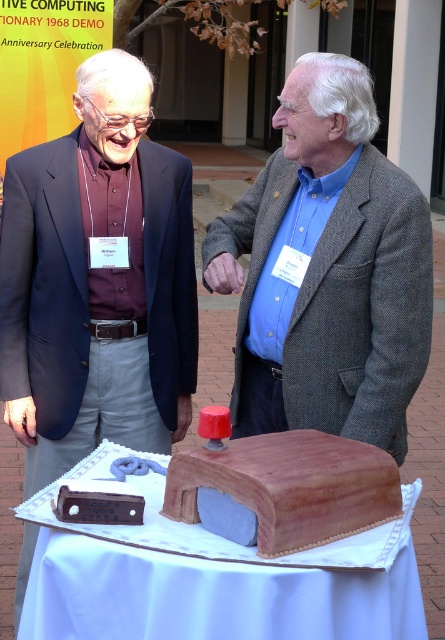
You are a photographer at the event and want to take a picture of the vintage computer cake on the table. There is a point at coordinates point (327, 269) that you need to consider. Is this point located on the vintage computer cake?

The point (327, 269) is on blue woolen jacket at center, so it is not on the vintage computer cake.

You are a photographer at the event and need to position a spotlight exactly at the location of the blue woolen jacket at center. What are the coordinates where you should place the spotlight?

The coordinates for the blue woolen jacket at center are at point (327, 269).

Based on the scene description, where is the blue woolen jacket at center located in the image?

The blue woolen jacket at center is located at point 0.423 on the x axis and 0.737 on the y axis.